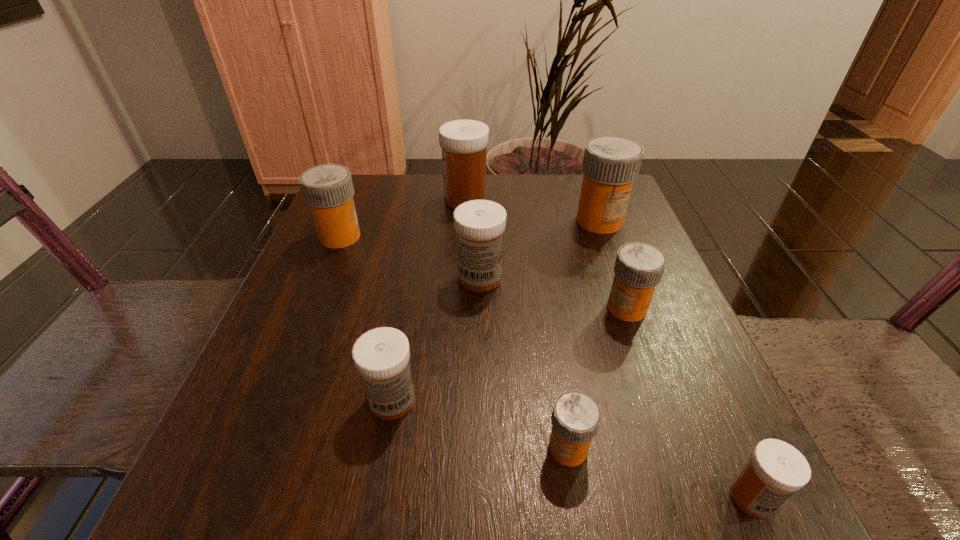
I want to click on the biggest orange medicine, so click(x=610, y=165).

Locate an element on the screen. The image size is (960, 540). the farthest white medicine is located at coordinates (464, 142).

In order to click on the leftmost medicine in this screenshot , I will do `click(328, 189)`.

Where is `the leftmost orange medicine`? The width and height of the screenshot is (960, 540). the leftmost orange medicine is located at coordinates (328, 189).

I want to click on the third smallest white medicine, so click(x=479, y=224).

Locate an element on the screen. the second nearest orange medicine is located at coordinates (639, 267).

The height and width of the screenshot is (540, 960). I want to click on the third farthest white medicine, so click(x=381, y=356).

The height and width of the screenshot is (540, 960). In order to click on the seventh object from right to left in this screenshot , I will do `click(381, 356)`.

Locate an element on the screen. Image resolution: width=960 pixels, height=540 pixels. the second nearest object is located at coordinates coord(575,418).

In order to click on the second orange medicine from left to right in this screenshot , I will do `click(575, 418)`.